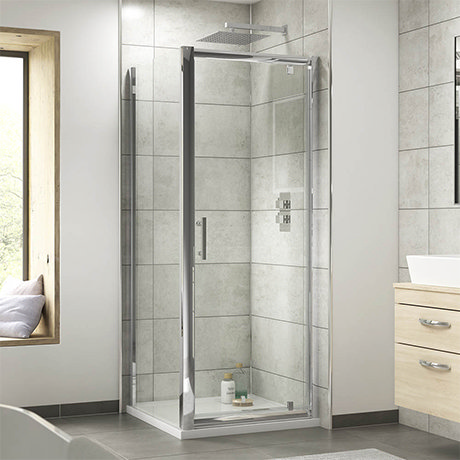
Identify the location of sink. (444, 265).